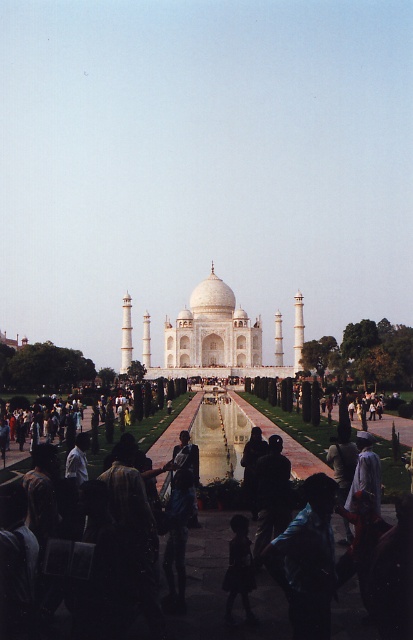
Question: Can you confirm if white marble taj mahal at center is smaller than black fabric at center?

Choices:
 (A) yes
 (B) no

Answer: (B)

Question: Is white marble taj mahal at center closer to camera compared to black fabric at center?

Choices:
 (A) yes
 (B) no

Answer: (B)

Question: Does white marble taj mahal at center appear on the left side of black fabric at center?

Choices:
 (A) yes
 (B) no

Answer: (A)

Question: Which of the following is the closest to the observer?

Choices:
 (A) (303, 531)
 (B) (147, 356)

Answer: (A)

Question: Which point appears farthest from the camera in this image?

Choices:
 (A) (215, 292)
 (B) (291, 522)

Answer: (A)